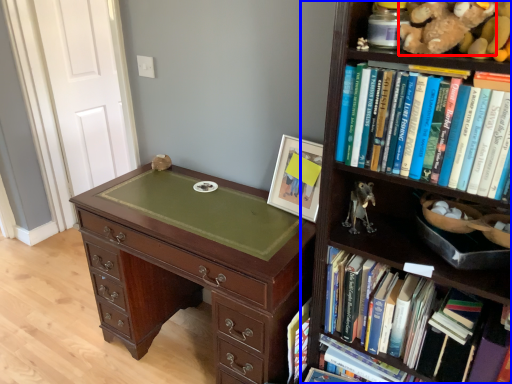
Question: Which object appears closest to the camera in this image, teddy (highlighted by a red box) or bookcase (highlighted by a blue box)?

Choices:
 (A) teddy
 (B) bookcase

Answer: (B)